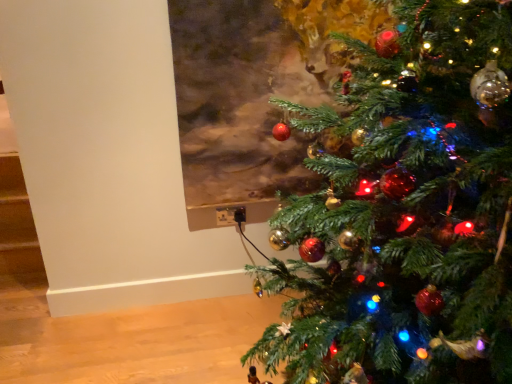
The height and width of the screenshot is (384, 512). What do you see at coordinates (404, 210) in the screenshot?
I see `shiny green christmas tree at right` at bounding box center [404, 210].

Measure the distance between shiny green christmas tree at right and camera.

shiny green christmas tree at right and camera are 26.92 inches apart.

At what (x,y) coordinates should I click in order to perform the action: click on shiny green christmas tree at right. Please return your answer as a coordinate pair (x, y). The image size is (512, 384). Looking at the image, I should click on (404, 210).

Where is `shiny green christmas tree at right`? Image resolution: width=512 pixels, height=384 pixels. shiny green christmas tree at right is located at coordinates (404, 210).